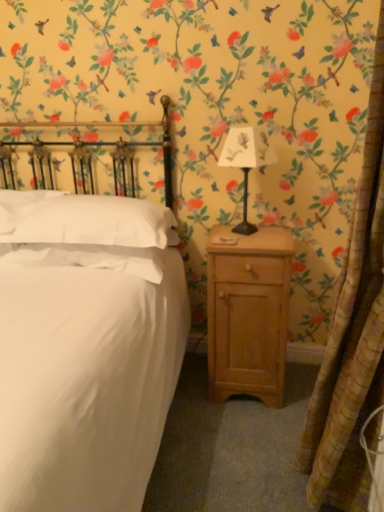
The height and width of the screenshot is (512, 384). Find the location of `empty space that is ontop of light wood nightstand at right (from a real-world perspective)`. empty space that is ontop of light wood nightstand at right (from a real-world perspective) is located at coordinates (236, 243).